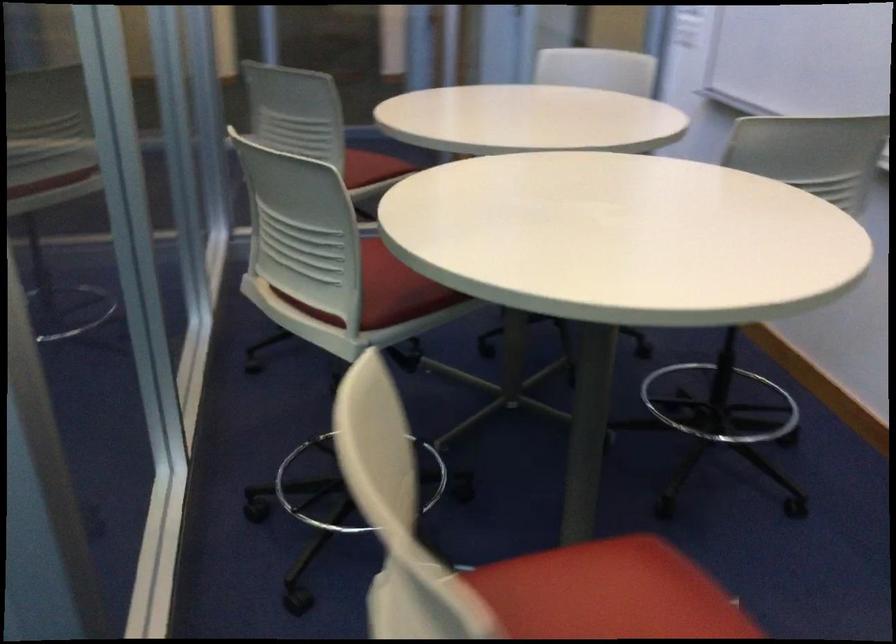
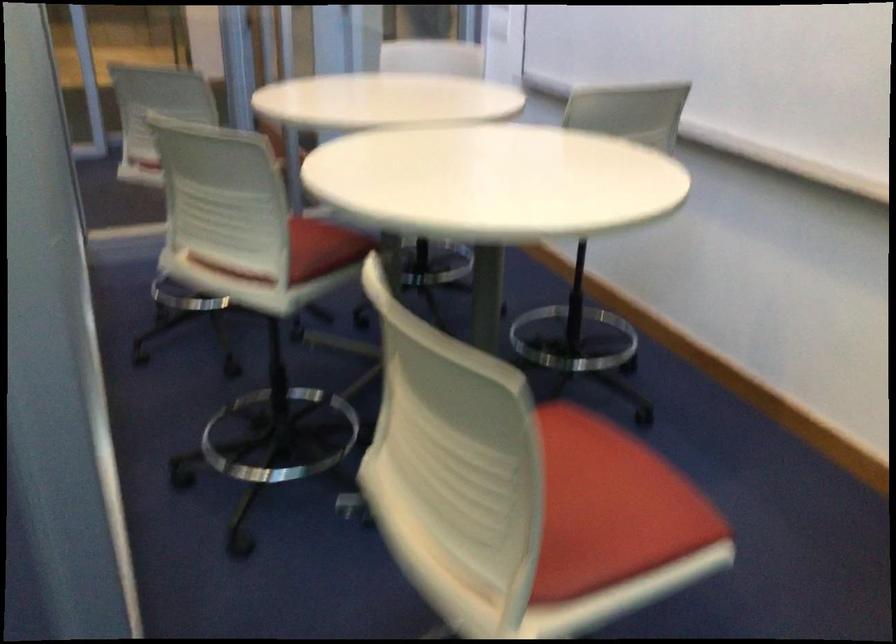
Where in the second image is the point corresponding to (x=411, y=288) from the first image?

(322, 249)